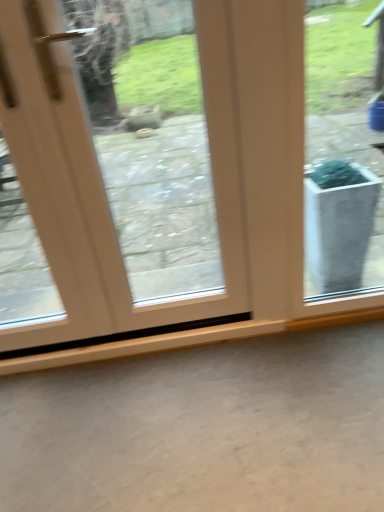
This screenshot has width=384, height=512. What do you see at coordinates (203, 428) in the screenshot? I see `gray matte concrete at lower center` at bounding box center [203, 428].

You are a GUI agent. You are given a task and a screenshot of the screen. Output one action in this format:
    pyautogui.click(x=<x>, y=<y>)
    Task: Click on the gray matte concrete at lower center
    The width and height of the screenshot is (384, 512).
    Given the screenshot: What is the action you would take?
    pyautogui.click(x=203, y=428)

The height and width of the screenshot is (512, 384). What do you see at coordinates (116, 170) in the screenshot? I see `white glossy door at center` at bounding box center [116, 170].

This screenshot has width=384, height=512. Identify the location of white glossy door at center. (116, 170).

Find the location of a particular element. gray matte concrete at lower center is located at coordinates (203, 428).

Is gray matte concrete at lower center to the left or to the right of white glossy door at center in the image?

Based on their positions, gray matte concrete at lower center is located to the right of white glossy door at center.

Is gray matte concrete at lower center further to the viewer compared to white glossy door at center?

Yes, it is behind white glossy door at center.

Is point (150, 374) positioned after point (131, 16)?

Yes, it is.

From the image's perspective, which one is positioned higher, gray matte concrete at lower center or white glossy door at center?

white glossy door at center is shown above in the image.

From a real-world perspective, is gray matte concrete at lower center beneath white glossy door at center?

Yes, from a real-world perspective, gray matte concrete at lower center is beneath white glossy door at center.

Can you confirm if gray matte concrete at lower center is thinner than white glossy door at center?

No.

Who is taller, gray matte concrete at lower center or white glossy door at center?

With more height is white glossy door at center.

Between gray matte concrete at lower center and white glossy door at center, which one has smaller size?

gray matte concrete at lower center is smaller.

Is white glossy door at center completely or partially inside gray matte concrete at lower center?

That's incorrect, white glossy door at center is not inside gray matte concrete at lower center.

Is gray matte concrete at lower center beside white glossy door at center?

No, gray matte concrete at lower center is not with white glossy door at center.

Is gray matte concrete at lower center positioned with its back to white glossy door at center?

No, white glossy door at center is not at the back of gray matte concrete at lower center.

This screenshot has height=512, width=384. In the image, there is a white glossy door at center. Identify the location of concrete below it (from the image's perspective). (203, 428).

Is white glossy door at center to the left of gray matte concrete at lower center from the viewer's perspective?

Indeed, white glossy door at center is positioned on the left side of gray matte concrete at lower center.

In the image, is white glossy door at center positioned in front of or behind gray matte concrete at lower center?

In the image, white glossy door at center appears in front of gray matte concrete at lower center.

Which point is more distant from viewer, (100, 88) or (344, 402)?

Point (100, 88)

From the image's perspective, is white glossy door at center above or below gray matte concrete at lower center?

Based on their image positions, white glossy door at center is located above gray matte concrete at lower center.

From a real-world perspective, which is physically above, white glossy door at center or gray matte concrete at lower center?

From a 3D spatial view, white glossy door at center is above.

Considering the sizes of objects white glossy door at center and gray matte concrete at lower center in the image provided, who is wider, white glossy door at center or gray matte concrete at lower center?

Wider between the two is gray matte concrete at lower center.

Between white glossy door at center and gray matte concrete at lower center, which one has less height?

Standing shorter between the two is gray matte concrete at lower center.

Can you confirm if white glossy door at center is smaller than gray matte concrete at lower center?

Actually, white glossy door at center might be larger than gray matte concrete at lower center.

Can we say white glossy door at center lies outside gray matte concrete at lower center?

Yes, white glossy door at center is located beyond the bounds of gray matte concrete at lower center.

Is white glossy door at center far away from gray matte concrete at lower center?

That's not correct — white glossy door at center is a little close to gray matte concrete at lower center.

Is white glossy door at center oriented away from gray matte concrete at lower center?

No, white glossy door at center is not facing away from gray matte concrete at lower center.

How many degrees apart are the facing directions of white glossy door at center and gray matte concrete at lower center?

The angular difference between white glossy door at center and gray matte concrete at lower center is 88.9 degrees.

How far apart are white glossy door at center and gray matte concrete at lower center?

white glossy door at center and gray matte concrete at lower center are 35.57 inches apart from each other.

Locate an element on the screen. The height and width of the screenshot is (512, 384). door that appears on the left of gray matte concrete at lower center is located at coordinates (116, 170).

Locate an element on the screen. door in front of the gray matte concrete at lower center is located at coordinates (116, 170).

Image resolution: width=384 pixels, height=512 pixels. I want to click on concrete directly beneath the white glossy door at center (from a real-world perspective), so click(x=203, y=428).